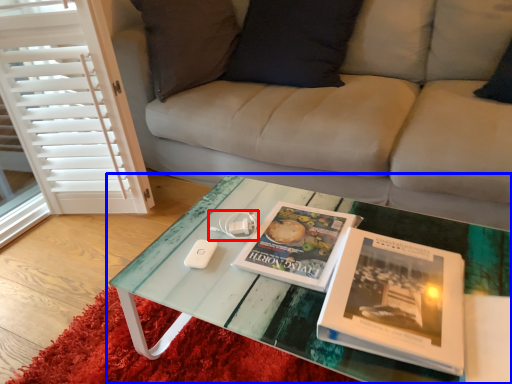
Question: Which object is further to the camera taking this photo, game controller (highlighted by a red box) or coffee table (highlighted by a blue box)?

Choices:
 (A) game controller
 (B) coffee table

Answer: (A)